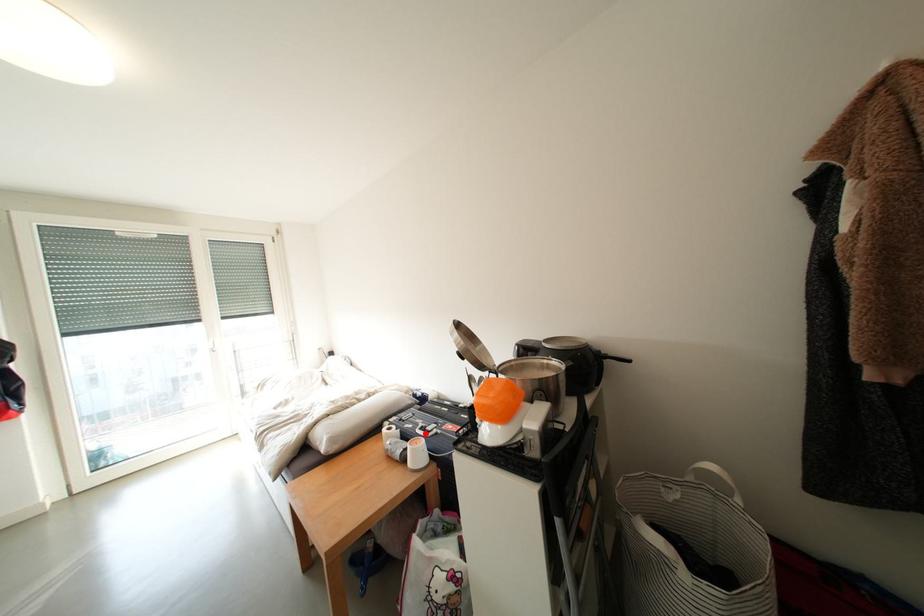
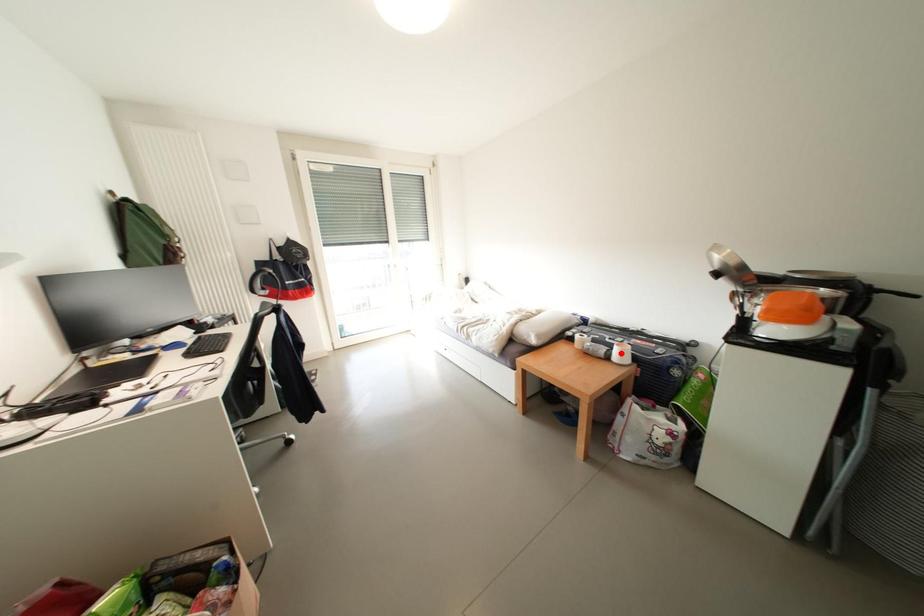
I am providing you with two images of the same scene from different viewpoints. A red point is marked on the first image and another point is marked on the second image. Is the red point in image1 aligned with the point shown in image2?

No